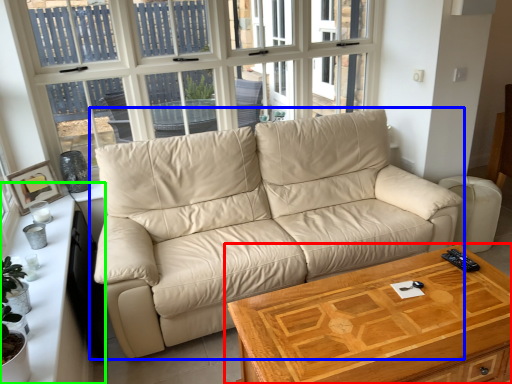
Question: Which object is the farthest from table (highlighted by a red box)? Choose among these: studio couch (highlighted by a blue box) or dresser (highlighted by a green box).

Choices:
 (A) studio couch
 (B) dresser

Answer: (B)